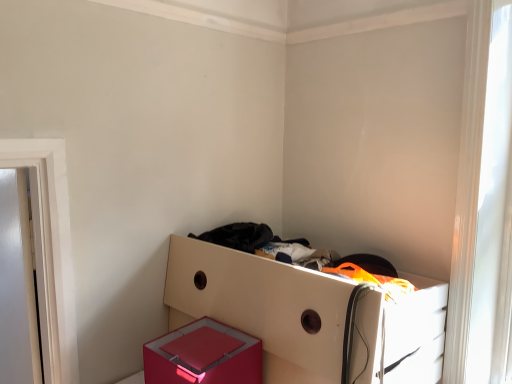
Question: From a real-world perspective, is shiny pink box at lower center physically below white glossy drawer at center?

Choices:
 (A) yes
 (B) no

Answer: (B)

Question: From the image's perspective, is shiny pink box at lower center below white glossy drawer at center?

Choices:
 (A) yes
 (B) no

Answer: (A)

Question: Does shiny pink box at lower center turn towards white glossy drawer at center?

Choices:
 (A) no
 (B) yes

Answer: (A)

Question: Is shiny pink box at lower center far from white glossy drawer at center?

Choices:
 (A) yes
 (B) no

Answer: (B)

Question: Is shiny pink box at lower center located outside white glossy drawer at center?

Choices:
 (A) yes
 (B) no

Answer: (A)

Question: Is shiny pink box at lower center turned away from white glossy drawer at center?

Choices:
 (A) yes
 (B) no

Answer: (A)

Question: From the image's perspective, is white glossy drawer at center under shiny pink box at lower center?

Choices:
 (A) yes
 (B) no

Answer: (B)

Question: Is white glossy drawer at center bigger than shiny pink box at lower center?

Choices:
 (A) yes
 (B) no

Answer: (A)

Question: Does white glossy drawer at center appear on the left side of shiny pink box at lower center?

Choices:
 (A) yes
 (B) no

Answer: (B)

Question: Are white glossy drawer at center and shiny pink box at lower center making contact?

Choices:
 (A) yes
 (B) no

Answer: (B)

Question: Is white glossy drawer at center closer to camera compared to shiny pink box at lower center?

Choices:
 (A) yes
 (B) no

Answer: (A)

Question: Is white glossy drawer at center further to the viewer compared to shiny pink box at lower center?

Choices:
 (A) yes
 (B) no

Answer: (B)

Question: Is transparent glass window at upper right surrounding white glossy drawer at center?

Choices:
 (A) no
 (B) yes

Answer: (A)